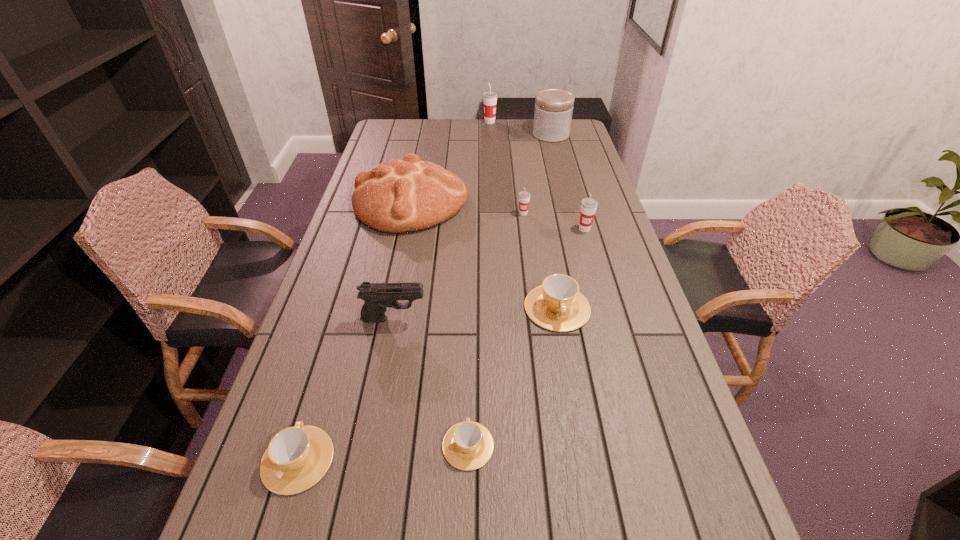
Where is `the farthest brown cup`? This screenshot has height=540, width=960. the farthest brown cup is located at coordinates (557, 305).

Identify the location of the leftmost cup. Image resolution: width=960 pixels, height=540 pixels. (297, 457).

Locate an element on the screen. This screenshot has height=540, width=960. the leftmost brown cup is located at coordinates (297, 457).

The image size is (960, 540). What are the coordinates of `the shortest cup` in the screenshot? It's located at (468, 445).

Identify the location of the second brown cup from left to right. (468, 445).

The width and height of the screenshot is (960, 540). What are the coordinates of `vacant region located on the side of the farthest red cup with the logo` in the screenshot? It's located at (447, 122).

What are the coordinates of `vacant space located 0.130m on the side of the farthest red cup with the logo` in the screenshot? It's located at point(455,122).

At what (x,y) coordinates should I click in order to perform the action: click on free space located 0.180m on the side of the farthest red cup with the logo. Please return your answer as a coordinate pair (x, y). This screenshot has width=960, height=540. Looking at the image, I should click on (444, 122).

Identify the location of vacant space situated 0.220m on the left of the second farthest object. The image size is (960, 540). (484, 134).

You are a GUI agent. You are given a task and a screenshot of the screen. Output one action in this format:
    pyautogui.click(x=<x>, y=<y>)
    Task: Click on the vacant space located on the back of the bread
    This screenshot has width=960, height=540.
    Given the screenshot: What is the action you would take?
    pyautogui.click(x=420, y=152)